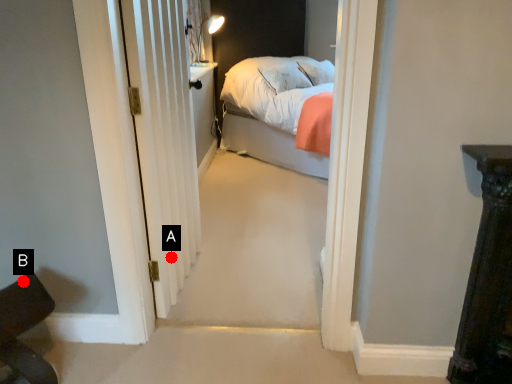
Question: Two points are circled on the image, labeled by A and B beside each circle. Which point appears closest to the camera in this image?

Choices:
 (A) A is closer
 (B) B is closer

Answer: (B)